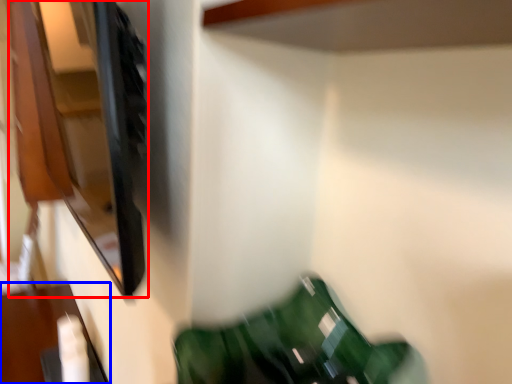
Question: Which point is closer to the camera, cabinet (highlighted by a red box) or furniture (highlighted by a blue box)?

Choices:
 (A) cabinet
 (B) furniture

Answer: (A)